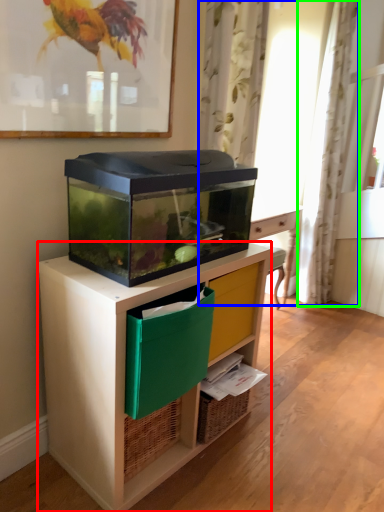
Question: Which is farther away from desk (highlighted by a red box)? curtain (highlighted by a blue box) or curtain (highlighted by a green box)?

Choices:
 (A) curtain
 (B) curtain

Answer: (A)